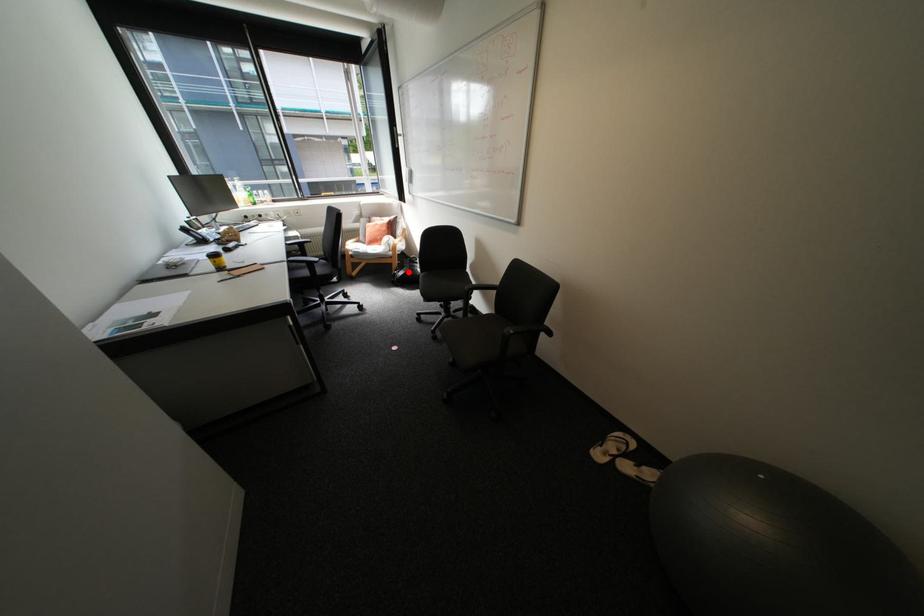
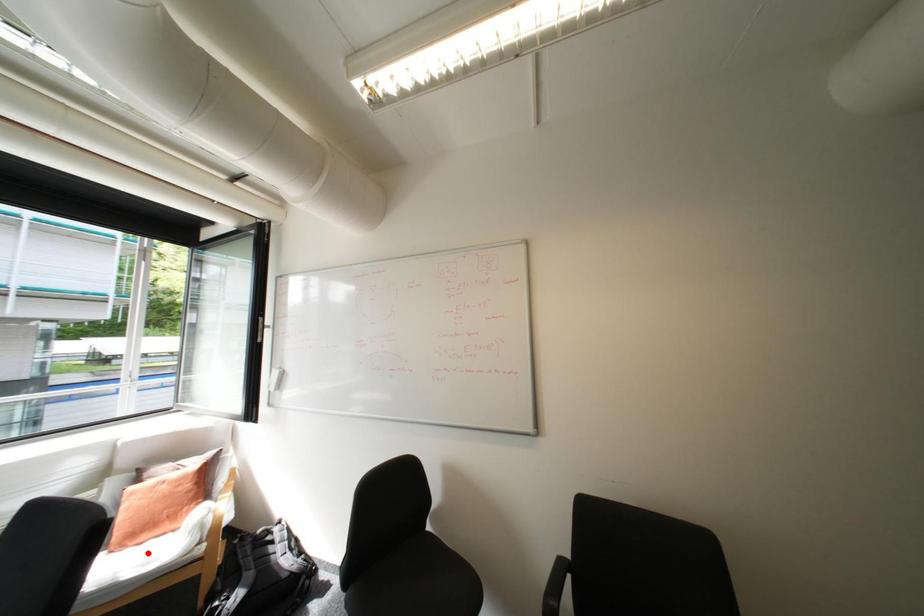
I am providing you with two images of the same scene from different viewpoints. A red point is marked on the first image and another point is marked on the second image. Are the points marked in image1 and image2 representing the same 3D position?

No